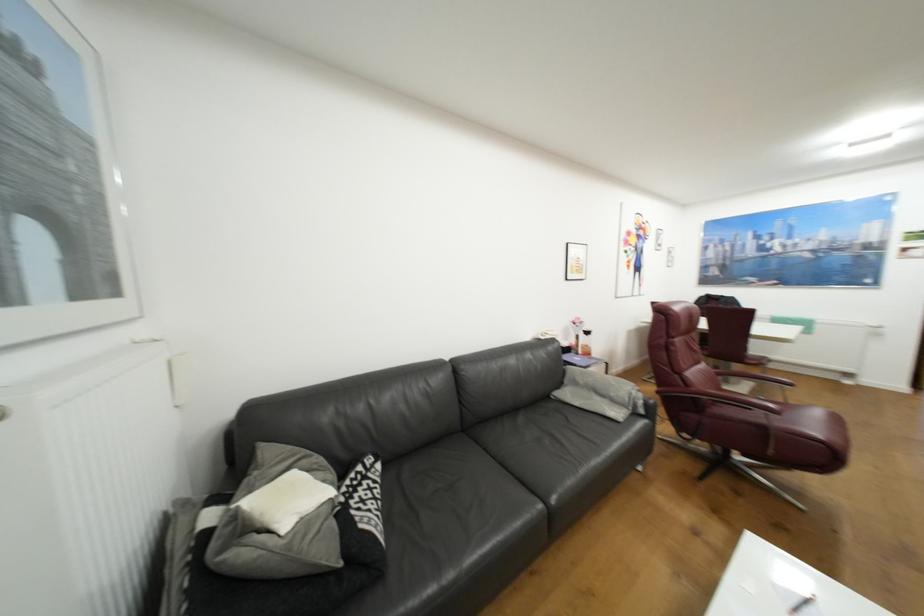
Describe the element at coordinates (543, 451) in the screenshot. Image resolution: width=924 pixels, height=616 pixels. I see `a sofa sitting surface` at that location.